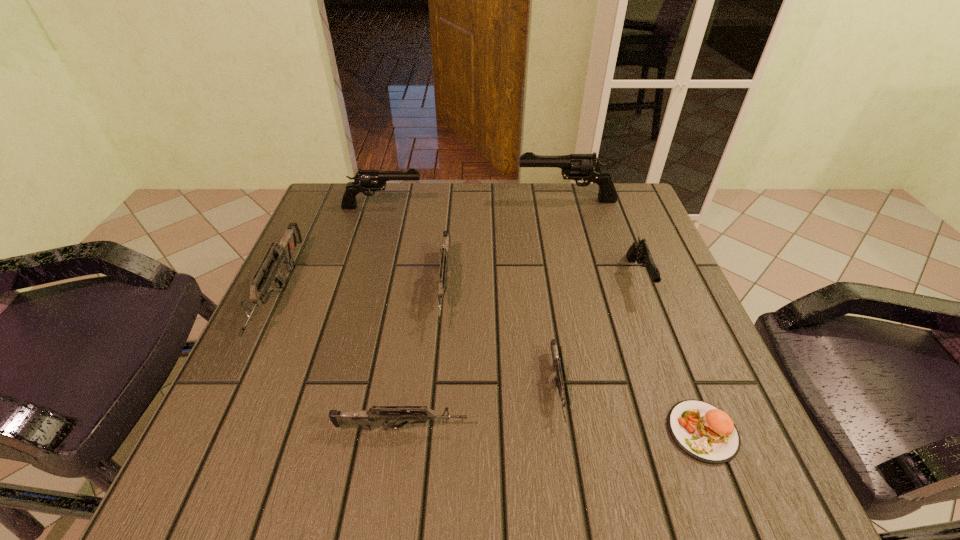
Identify the location of vacant area at the right edge of the desktop. This screenshot has height=540, width=960. (612, 261).

In the image, there is a desktop. Where is `vacant space at the far left corner`? vacant space at the far left corner is located at coordinates (347, 185).

Find the location of a particular element. Image resolution: width=960 pixels, height=540 pixels. free space at the near left corner of the desktop is located at coordinates (276, 451).

The height and width of the screenshot is (540, 960). Identify the location of free space at the far right corner of the desktop. (620, 227).

At what (x,y) coordinates should I click in order to perform the action: click on empty space that is in between the nearest black gun and the shortest object. Please return your answer as a coordinate pair (x, y). This screenshot has height=540, width=960. Looking at the image, I should click on (670, 355).

This screenshot has width=960, height=540. Identify the location of free space between the shortest object and the leftmost gun. (491, 362).

Image resolution: width=960 pixels, height=540 pixels. Identify the location of unoccupied area between the leftmost gun and the shortest object. (491, 362).

You are a GUI agent. You are given a task and a screenshot of the screen. Output one action in this format:
    pyautogui.click(x=<x>, y=<y>)
    Task: Click on the empty space between the shortest object and the rightmost grey gun
    The width and height of the screenshot is (960, 540).
    Given the screenshot: What is the action you would take?
    pyautogui.click(x=630, y=409)

You are a GUI agent. You are given a task and a screenshot of the screen. Output one action in this format:
    pyautogui.click(x=<x>, y=<y>)
    Task: Click on the vacant area that lies between the tallest gun and the third smallest grey gun
    The width and height of the screenshot is (960, 540).
    Given the screenshot: What is the action you would take?
    point(506,245)

I want to click on free spot between the biggest grey gun and the shortest object, so click(x=491, y=362).